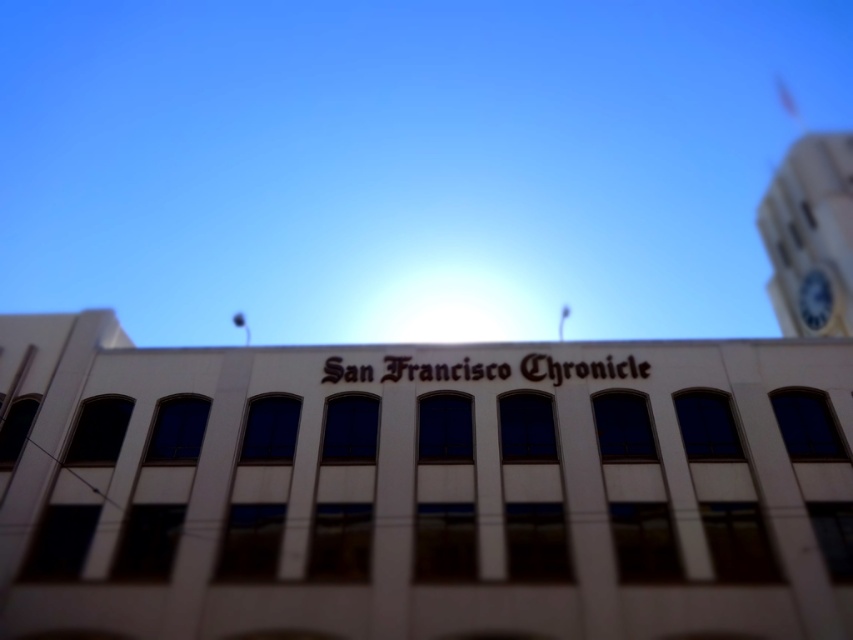
You are standing in front of the San Francisco Chronicle building and notice two points marked on the facade. The first point is at coordinates point (851, 262) and the second is at point (809, 321). Which of these points is closer to you?

Point (851, 262) is in front of point (809, 321), so it is closer to you.

You are a photographer standing at the base of the San Francisco Chronicle building. You want to take a photo that includes both the building and the white clock tower at upper right. The camera you are using has a maximum zoom range of 100 meters. Will you be able to capture both in one shot without moving the camera?

The white clock tower at upper right is 25.64 meters away from the camera. Since the camera has a maximum zoom range of 100 meters, which is greater than the distance to the tower, you can capture both the building and the white clock tower at upper right in one shot without moving the camera.

You are standing in front of the San Francisco Chronicle building and want to locate the white clock tower at upper right. According to the image coordinates, where exactly is it positioned?

The white clock tower at upper right is positioned at coordinates point (810,236).